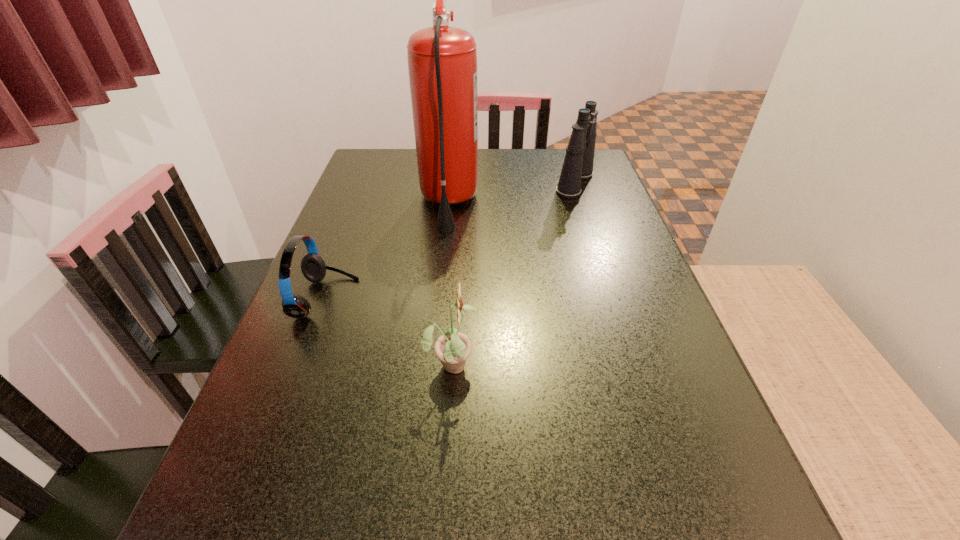
Find the location of a particular element. The height and width of the screenshot is (540, 960). unoccupied position between the leftmost object and the third tallest object is located at coordinates point(389,331).

I want to click on free space between the rightmost object and the third farthest object, so click(450, 241).

This screenshot has height=540, width=960. What are the coordinates of `vacant area that lies between the binoculars and the sunflower` in the screenshot? It's located at (514, 273).

At what (x,y) coordinates should I click in order to perform the action: click on free space between the fire extinguisher and the third tallest object. Please return your answer as a coordinate pair (x, y). Image resolution: width=960 pixels, height=540 pixels. Looking at the image, I should click on (450, 283).

Find the location of `free area in between the third shortest object and the headset`. free area in between the third shortest object and the headset is located at coordinates (450, 241).

Where is `vacant space that's between the headset and the tallest object`? The width and height of the screenshot is (960, 540). vacant space that's between the headset and the tallest object is located at coordinates (387, 251).

Locate an element on the screen. the closest object to the second tallest object is located at coordinates (442, 61).

Where is `object that is the third closest to the third tallest object`? The image size is (960, 540). object that is the third closest to the third tallest object is located at coordinates (578, 163).

Locate an element on the screen. The image size is (960, 540). vacant region that satisfies the following two spatial constraints: 1. on the front side of the rightmost object; 2. on the instruction side of the tallest object is located at coordinates (581, 202).